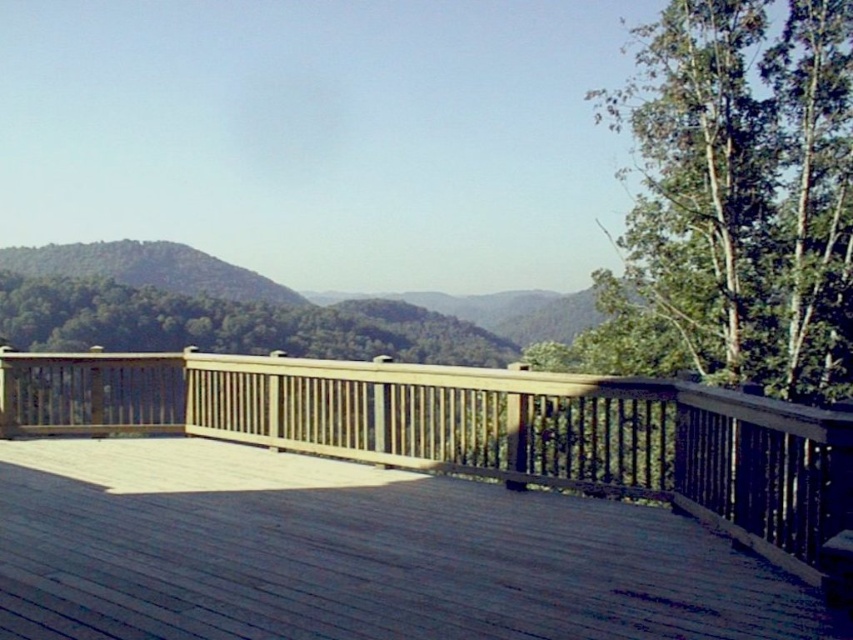
Does wooden deck at center have a lesser width compared to green leafy tree at upper right?

Incorrect, wooden deck at center's width is not less than green leafy tree at upper right's.

Who is more forward, [718,516] or [645,291]?

Point [718,516] is more forward.

What do you see at coordinates (477, 429) in the screenshot? I see `wooden deck at center` at bounding box center [477, 429].

This screenshot has width=853, height=640. Identify the location of wooden deck at center. (477, 429).